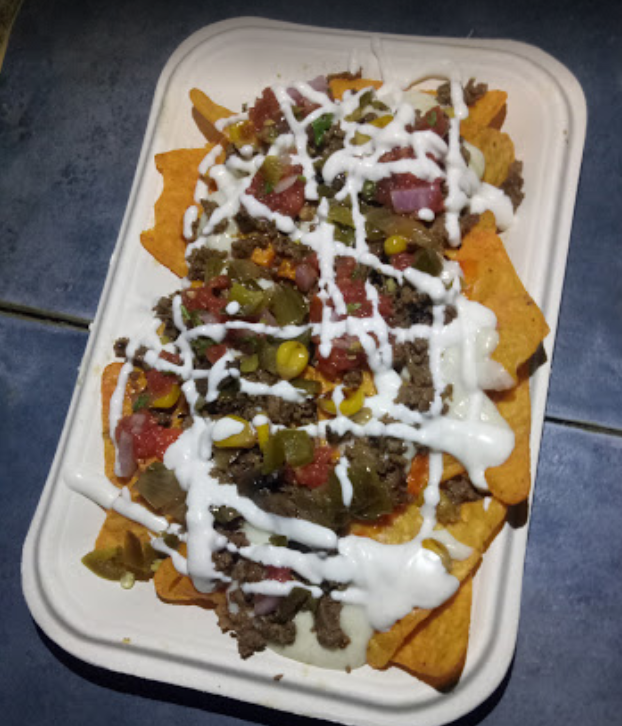
This screenshot has width=622, height=726. Identify the location of plate. (81, 605), (108, 333), (508, 621), (537, 404).